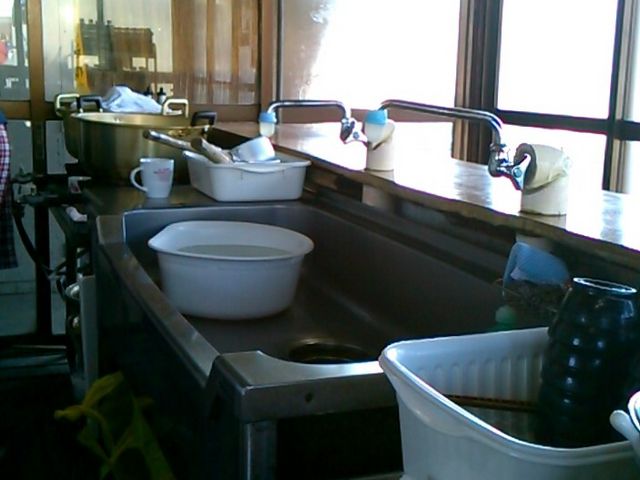
Find the location of a particular element. This screenshot has width=640, height=480. blueish white basket is located at coordinates (479, 456).